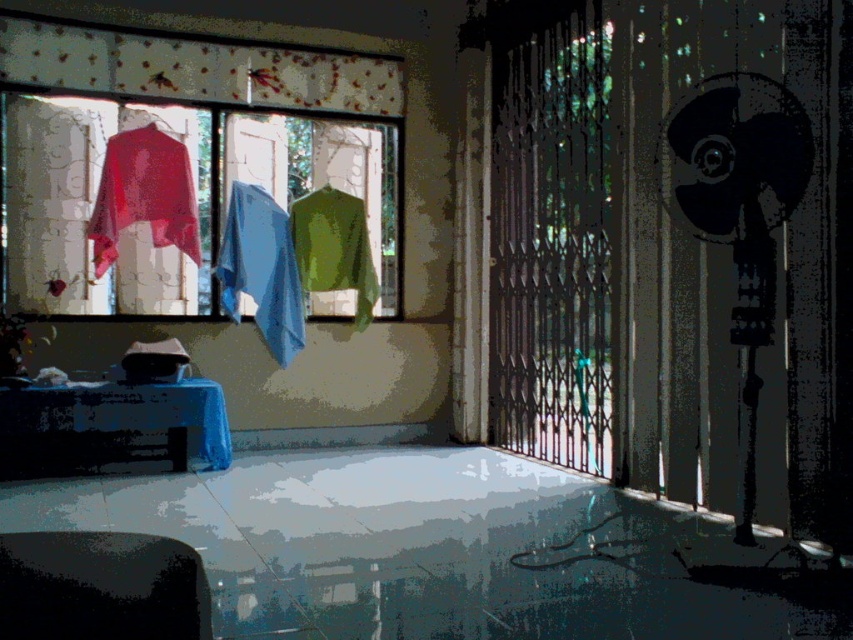
Question: Among these points, which one is farthest from the camera?

Choices:
 (A) (286, 257)
 (B) (728, 84)

Answer: (A)

Question: Which object appears closest to the camera in this image?

Choices:
 (A) patterned fabric curtain at upper left
 (B) matte plastic window at center

Answer: (A)

Question: Which object appears farthest from the camera in this image?

Choices:
 (A) matte red sweater at left
 (B) patterned fabric curtain at upper left

Answer: (A)

Question: Is black metal screen door at center further to the viewer compared to green matte shirt at center?

Choices:
 (A) no
 (B) yes

Answer: (A)

Question: Does matte plastic window at center appear on the left side of blue fabric at center?

Choices:
 (A) yes
 (B) no

Answer: (A)

Question: Is matte plastic window at center further to camera compared to patterned fabric curtain at upper left?

Choices:
 (A) no
 (B) yes

Answer: (B)